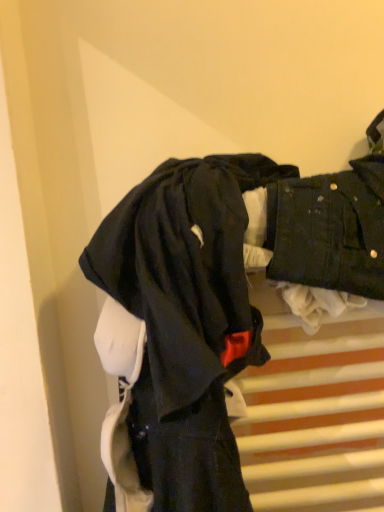
At what (x,y) coordinates should I click in order to perform the action: click on black matte wetsuit at center. Please return your answer as a coordinate pair (x, y). The width and height of the screenshot is (384, 512). Looking at the image, I should click on (217, 307).

What is the approximate height of black matte wetsuit at center?

black matte wetsuit at center is 20.25 inches tall.

What do you see at coordinates (217, 307) in the screenshot?
I see `black matte wetsuit at center` at bounding box center [217, 307].

I want to click on black matte wetsuit at center, so click(217, 307).